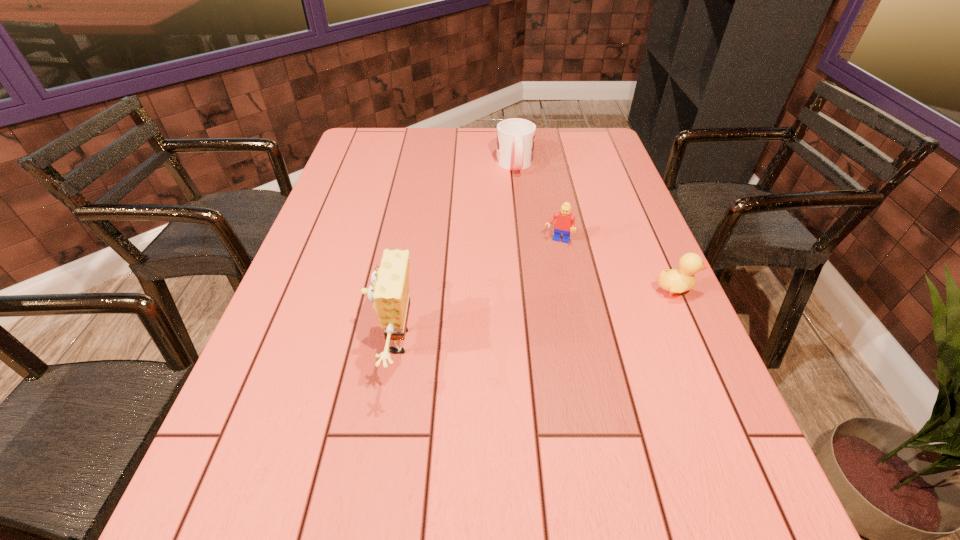
The width and height of the screenshot is (960, 540). Find the location of `vacant space in between the farthest object and the sponge`. vacant space in between the farthest object and the sponge is located at coordinates (x=455, y=254).

You are a GUI agent. You are given a task and a screenshot of the screen. Output one action in this format:
    pyautogui.click(x=<x>, y=<y>)
    Task: Click on the free area in between the Lego and the rightmost object
    The height and width of the screenshot is (540, 960).
    Given the screenshot: What is the action you would take?
    pyautogui.click(x=616, y=267)

This screenshot has height=540, width=960. What are the coordinates of `object that is the second closest to the sponge` in the screenshot? It's located at (515, 140).

Where is `the second closest object to the rightmost object`? the second closest object to the rightmost object is located at coordinates (515, 140).

Where is `vacant area that satisfies the following two spatial constraints: 1. on the front side of the third nearest object; 2. on the left side of the farthest object`? vacant area that satisfies the following two spatial constraints: 1. on the front side of the third nearest object; 2. on the left side of the farthest object is located at coordinates tap(523, 242).